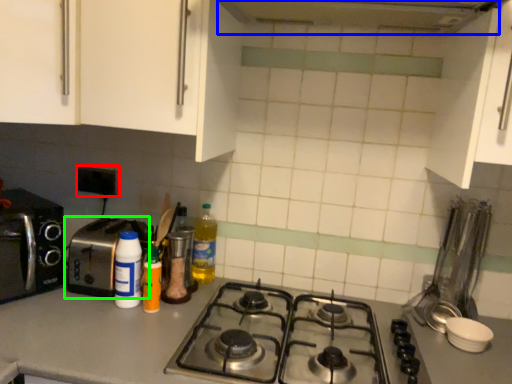
Question: Which object is positioned farthest from electric outlet (highlighted by a red box)? Select from exhaust hood (highlighted by a blue box) and toaster (highlighted by a green box).

Choices:
 (A) exhaust hood
 (B) toaster

Answer: (A)